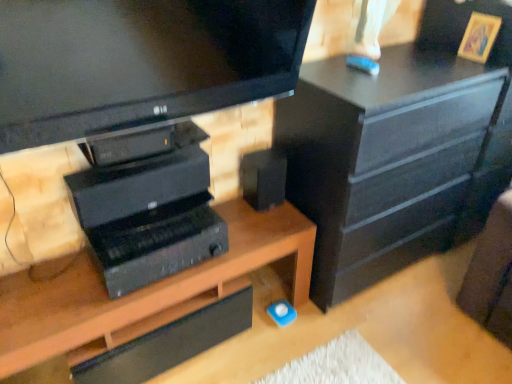
The height and width of the screenshot is (384, 512). In order to click on free area in between black matte speaker at center and black plastic computer at center in this screenshot , I will do `click(241, 225)`.